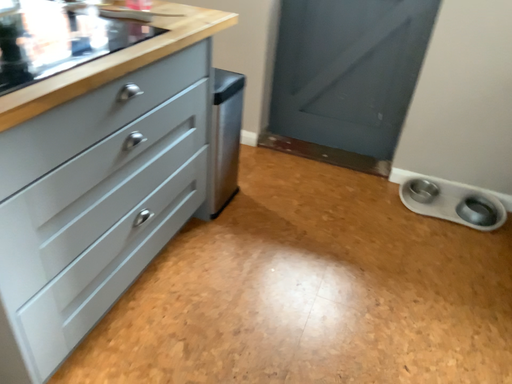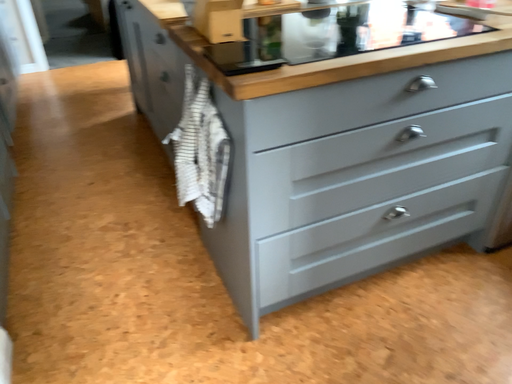
Question: Which way did the camera rotate in the video?

Choices:
 (A) rotated left
 (B) rotated right

Answer: (A)